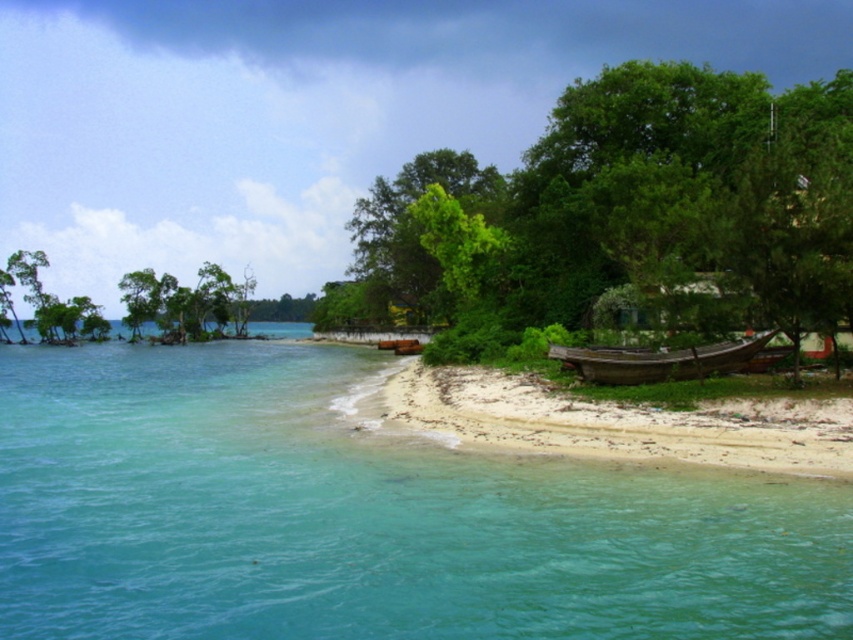
Is the position of green leafy tree at center more distant than that of green leafy trees at center?

No, green leafy tree at center is in front of green leafy trees at center.

Is point (525, 227) closer to viewer compared to point (163, 278)?

That is True.

Image resolution: width=853 pixels, height=640 pixels. Find the location of `green leafy tree at center`. green leafy tree at center is located at coordinates pos(641,211).

Is clear blue water at lower left in front of green leafy trees at center?

Yes, it is in front of green leafy trees at center.

The height and width of the screenshot is (640, 853). Describe the element at coordinates (366, 515) in the screenshot. I see `clear blue water at lower left` at that location.

Which is in front, point (379, 586) or point (173, 326)?

Point (379, 586) is in front.

This screenshot has height=640, width=853. Identify the location of clear blue water at lower left. (366, 515).

Is green leafy tree at center to the right of white sandy beach at lower right from the viewer's perspective?

Incorrect, green leafy tree at center is not on the right side of white sandy beach at lower right.

Is green leafy tree at center in front of white sandy beach at lower right?

No, green leafy tree at center is further to the viewer.

Who is more forward, (749, 148) or (743, 449)?

Point (743, 449) is more forward.

This screenshot has width=853, height=640. What are the coordinates of `green leafy tree at center` in the screenshot? It's located at (641, 211).